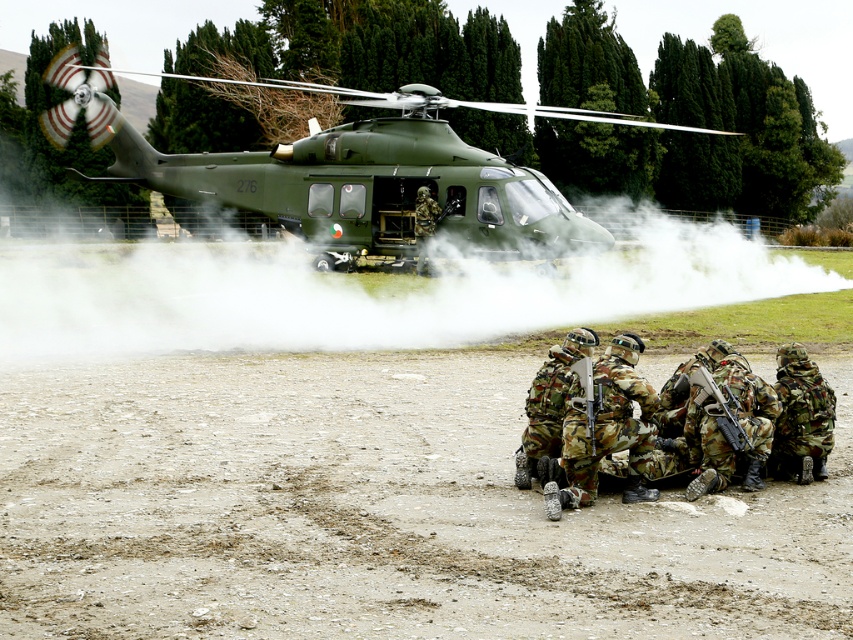
Is point (801, 449) less distant than point (726, 419)?

No, (801, 449) is behind (726, 419).

Is camouflage fabric helmet at lower right positioned before camouflage-patterned rifle at lower center?

That is False.

The image size is (853, 640). I want to click on camouflage fabric helmet at lower right, so click(801, 417).

Which is below, dirt field at lower center or green matte helicopter at upper center?

dirt field at lower center is below.

Between point (813, 524) and point (471, 228), which one is positioned behind?

The point (471, 228) is more distant.

This screenshot has width=853, height=640. Describe the element at coordinates (373, 512) in the screenshot. I see `dirt field at lower center` at that location.

Image resolution: width=853 pixels, height=640 pixels. Identify the location of dirt field at lower center. (373, 512).

Does green matte helicopter at upper center come in front of camo fabric soldiers at lower center?

That is False.

Who is positioned more to the right, green matte helicopter at upper center or camo fabric soldiers at lower center?

From the viewer's perspective, camo fabric soldiers at lower center appears more on the right side.

Image resolution: width=853 pixels, height=640 pixels. I want to click on green matte helicopter at upper center, so click(335, 168).

Find the location of `green matte helicopter at upper center`. green matte helicopter at upper center is located at coordinates (335, 168).